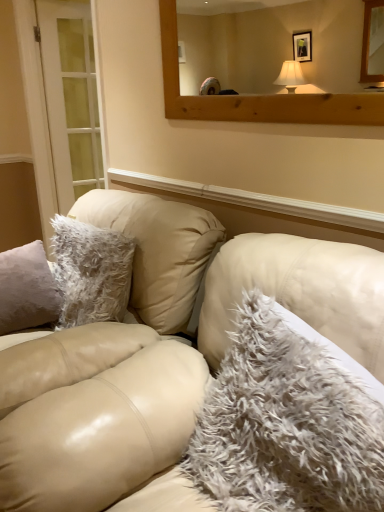
Question: Is fuzzy white pillow at center in front of wooden mirror at upper center?

Choices:
 (A) no
 (B) yes

Answer: (B)

Question: From a real-world perspective, is fuzzy white pillow at center under wooden mirror at upper center?

Choices:
 (A) yes
 (B) no

Answer: (A)

Question: Are fuzzy white pillow at center and wooden mirror at upper center making contact?

Choices:
 (A) yes
 (B) no

Answer: (B)

Question: Considering the relative positions of fuzzy white pillow at center and wooden mirror at upper center in the image provided, is fuzzy white pillow at center to the right of wooden mirror at upper center from the viewer's perspective?

Choices:
 (A) no
 (B) yes

Answer: (B)

Question: Is fuzzy white pillow at center looking in the opposite direction of wooden mirror at upper center?

Choices:
 (A) no
 (B) yes

Answer: (A)

Question: Would you say fuzzy white pillow at center is outside wooden mirror at upper center?

Choices:
 (A) no
 (B) yes

Answer: (B)

Question: From the image's perspective, is leather couch at center below fuzzy white pillow at center?

Choices:
 (A) yes
 (B) no

Answer: (A)

Question: Could fuzzy white pillow at center be considered to be inside leather couch at center?

Choices:
 (A) no
 (B) yes

Answer: (B)

Question: Considering the relative positions of leather couch at center and fuzzy white pillow at center in the image provided, is leather couch at center to the left of fuzzy white pillow at center from the viewer's perspective?

Choices:
 (A) no
 (B) yes

Answer: (B)

Question: Does leather couch at center have a greater height compared to fuzzy white pillow at center?

Choices:
 (A) no
 (B) yes

Answer: (B)

Question: Considering the relative sizes of leather couch at center and fuzzy white pillow at center in the image provided, is leather couch at center bigger than fuzzy white pillow at center?

Choices:
 (A) yes
 (B) no

Answer: (A)

Question: Is leather couch at center placed right next to fuzzy white pillow at center?

Choices:
 (A) yes
 (B) no

Answer: (B)

Question: Can you confirm if leather couch at center is bigger than white glass door at left?

Choices:
 (A) no
 (B) yes

Answer: (B)